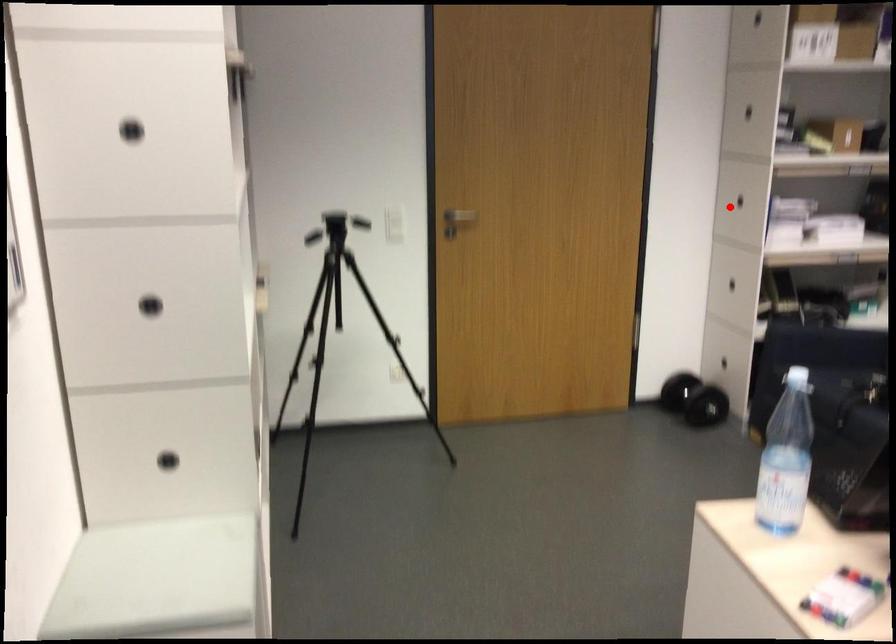
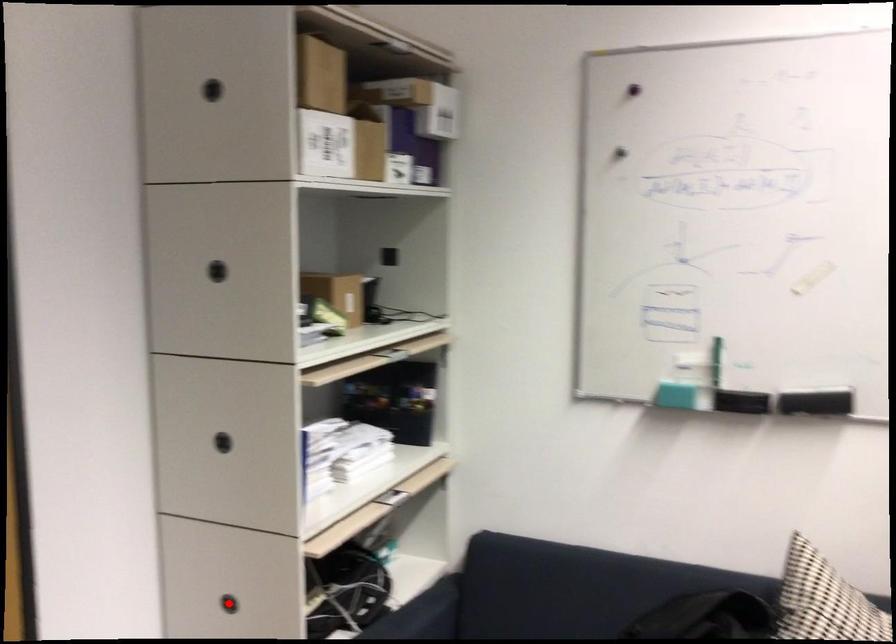
I am providing you with two images of the same scene from different viewpoints. A red point is marked on the first image and another point is marked on the second image. Are the points marked in image1 and image2 representing the same 3D position?

No